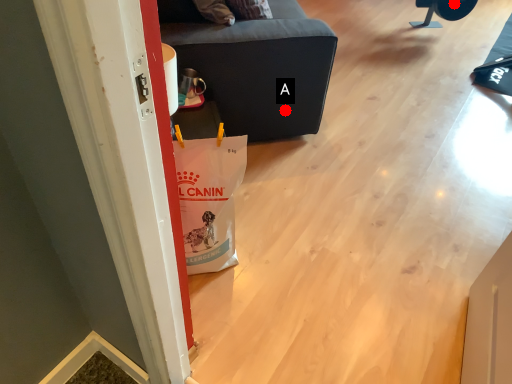
Question: Two points are circled on the image, labeled by A and B beside each circle. Which point is closer to the camera?

Choices:
 (A) A is closer
 (B) B is closer

Answer: (A)